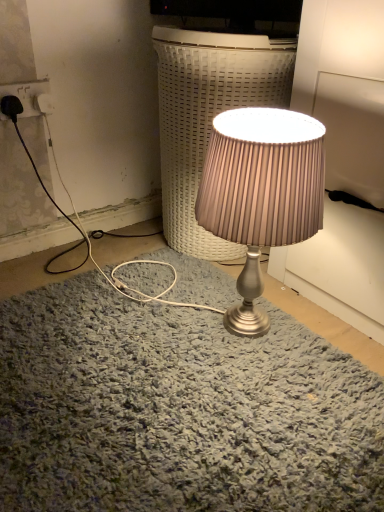
Question: Does white plastic socket at upper left come in front of satin silver lamp at center?

Choices:
 (A) yes
 (B) no

Answer: (B)

Question: Is white plastic socket at upper left further to the viewer compared to satin silver lamp at center?

Choices:
 (A) yes
 (B) no

Answer: (A)

Question: Is white plastic socket at upper left shorter than satin silver lamp at center?

Choices:
 (A) yes
 (B) no

Answer: (A)

Question: From the image's perspective, is white plastic socket at upper left located above satin silver lamp at center?

Choices:
 (A) yes
 (B) no

Answer: (A)

Question: From the image's perspective, is white plastic socket at upper left located beneath satin silver lamp at center?

Choices:
 (A) no
 (B) yes

Answer: (A)

Question: Is white plastic socket at upper left facing away from satin silver lamp at center?

Choices:
 (A) yes
 (B) no

Answer: (B)

Question: Are white plastic socket at upper left and satin silver lamp at center beside each other?

Choices:
 (A) no
 (B) yes

Answer: (A)

Question: Is white plastic socket at upper left at the right side of satin silver lamp at center?

Choices:
 (A) no
 (B) yes

Answer: (A)

Question: Is the position of white plastic socket at upper left less distant than that of satin silver lamp at center?

Choices:
 (A) no
 (B) yes

Answer: (A)

Question: From the image's perspective, is white plastic socket at upper left below satin silver lamp at center?

Choices:
 (A) no
 (B) yes

Answer: (A)

Question: Considering the relative sizes of white plastic socket at upper left and satin silver lamp at center in the image provided, is white plastic socket at upper left bigger than satin silver lamp at center?

Choices:
 (A) no
 (B) yes

Answer: (A)

Question: Is white plastic socket at upper left outside of satin silver lamp at center?

Choices:
 (A) yes
 (B) no

Answer: (A)

Question: Is satin silver lamp at center outside of satin silver lamp at center?

Choices:
 (A) yes
 (B) no

Answer: (A)